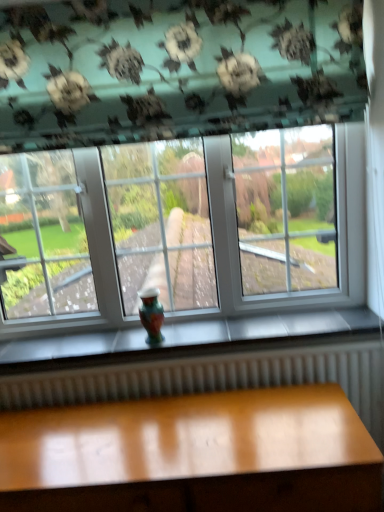
Question: In terms of width, does glossy wood table at lower center look wider or thinner when compared to multicolored glass vase at center?

Choices:
 (A) thin
 (B) wide

Answer: (B)

Question: From a real-world perspective, is glossy wood table at lower center positioned above or below multicolored glass vase at center?

Choices:
 (A) above
 (B) below

Answer: (B)

Question: Considering the relative positions of glossy wood table at lower center and multicolored glass vase at center in the image provided, is glossy wood table at lower center to the left or to the right of multicolored glass vase at center?

Choices:
 (A) left
 (B) right

Answer: (B)

Question: Considering the relative positions of multicolored glass vase at center and glossy wood table at lower center in the image provided, is multicolored glass vase at center to the left or to the right of glossy wood table at lower center?

Choices:
 (A) right
 (B) left

Answer: (B)

Question: Considering the positions of multicolored glass vase at center and glossy wood table at lower center in the image, is multicolored glass vase at center bigger or smaller than glossy wood table at lower center?

Choices:
 (A) small
 (B) big

Answer: (A)

Question: Considering the positions of point 162,336 and point 243,466, is point 162,336 closer or farther from the camera than point 243,466?

Choices:
 (A) closer
 (B) farther

Answer: (B)

Question: From a real-world perspective, is multicolored glass vase at center physically located above or below glossy wood table at lower center?

Choices:
 (A) above
 (B) below

Answer: (A)